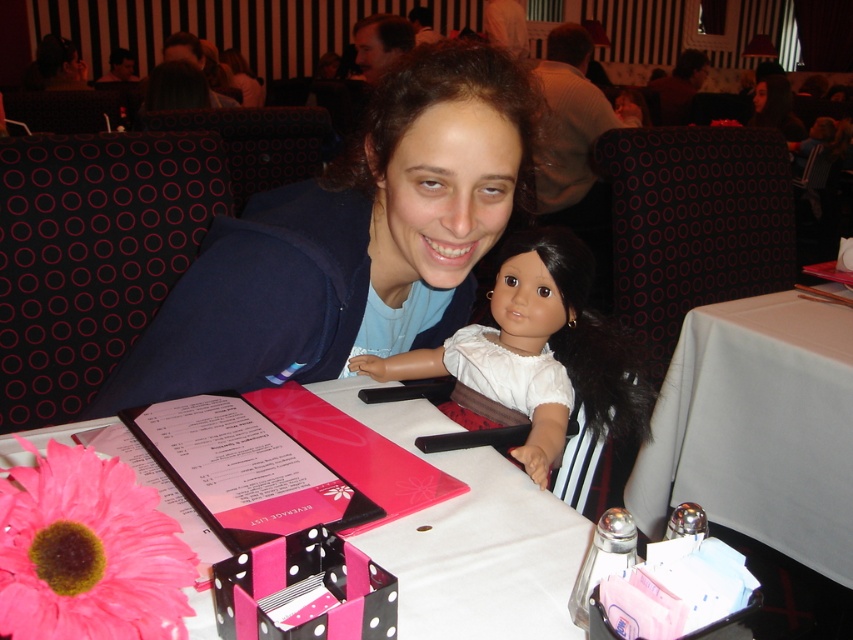
Question: Which point is closer to the camera?

Choices:
 (A) white matte doll at center
 (B) blue fabric at center

Answer: (B)

Question: Is white fabric table at right wider than white matte doll at center?

Choices:
 (A) no
 (B) yes

Answer: (B)

Question: Where is white fabric table at right located in relation to white matte doll at center in the image?

Choices:
 (A) left
 (B) right

Answer: (B)

Question: Based on their relative distances, which object is nearer to the blue fabric at center?

Choices:
 (A) white fabric table at right
 (B) white matte doll at center

Answer: (B)

Question: Which of the following is the farthest from the observer?

Choices:
 (A) (567, 378)
 (B) (230, 262)

Answer: (A)

Question: Can you confirm if blue fabric at center is positioned to the left of white fabric table at right?

Choices:
 (A) yes
 (B) no

Answer: (A)